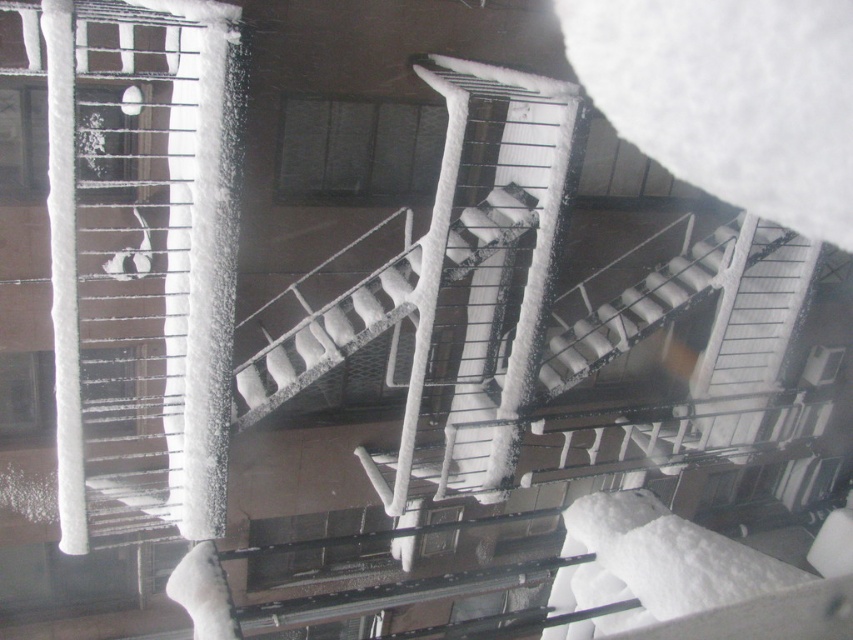
Question: Which object is farther from the camera taking this photo?

Choices:
 (A) snow-covered metal stairs at center
 (B) white matte stair at center

Answer: (B)

Question: Observing the image, what is the correct spatial positioning of snow-covered metal stairs at center in reference to white matte stair at center?

Choices:
 (A) right
 (B) left

Answer: (B)

Question: Is snow-covered metal stairs at center to the left of white matte stair at center from the viewer's perspective?

Choices:
 (A) yes
 (B) no

Answer: (A)

Question: Observing the image, what is the correct spatial positioning of snow-covered metal stairs at center in reference to white matte stair at center?

Choices:
 (A) below
 (B) above

Answer: (A)